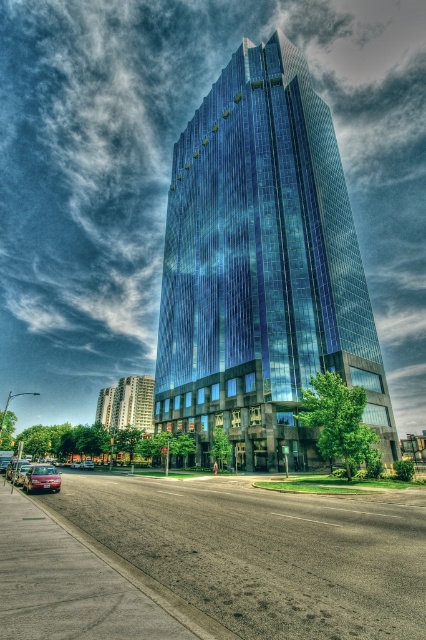
In the scene shown: Can you confirm if shiny red sedan at lower left is positioned above metallic silver sedan at center?

Yes.

Does shiny red sedan at lower left have a lesser width compared to metallic silver sedan at center?

Incorrect, shiny red sedan at lower left's width is not less than metallic silver sedan at center's.

I want to click on shiny red sedan at lower left, so click(42, 477).

What do you see at coordinates (261, 268) in the screenshot?
I see `shiny glass skyscraper at center` at bounding box center [261, 268].

Locate an element on the screen. The height and width of the screenshot is (640, 426). shiny glass skyscraper at center is located at coordinates (261, 268).

Does point (261, 74) come closer to viewer compared to point (36, 477)?

That is False.

Is the position of shiny glass skyscraper at center less distant than that of shiny red sedan at lower left?

No, it is behind shiny red sedan at lower left.

Who is more forward, (238, 106) or (57, 492)?

Point (57, 492) is in front.

Find the location of a particular element. The width and height of the screenshot is (426, 640). shiny glass skyscraper at center is located at coordinates (261, 268).